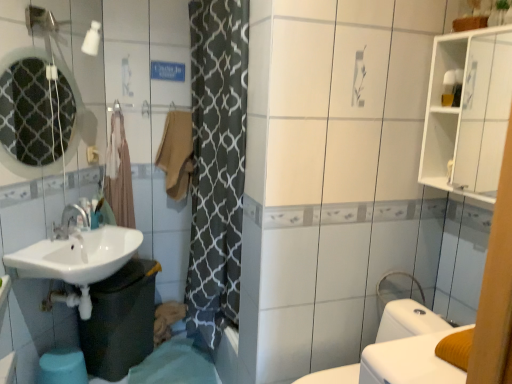
What do you see at coordinates (119, 174) in the screenshot?
I see `brown fabric shower curtain at left` at bounding box center [119, 174].

What do you see at coordinates (176, 153) in the screenshot?
I see `beige fabric towel at center` at bounding box center [176, 153].

The image size is (512, 384). What do you see at coordinates (77, 261) in the screenshot? I see `white glossy sink at lower left` at bounding box center [77, 261].

This screenshot has width=512, height=384. Identify the location of brown fabric shower curtain at left. (119, 174).

From a real-world perspective, is white glossy sink at lower left under brown fabric shower curtain at left?

Yes, from a real-world perspective, white glossy sink at lower left is beneath brown fabric shower curtain at left.

The width and height of the screenshot is (512, 384). Identify the location of sink below the brown fabric shower curtain at left (from a real-world perspective). (77, 261).

Does point (84, 259) appear closer or farther from the camera than point (116, 149)?

Point (84, 259) appears to be closer to the viewer than point (116, 149).

From the picture: Does white glossy sink at lower left have a greater width compared to brown fabric shower curtain at left?

Indeed, white glossy sink at lower left has a greater width compared to brown fabric shower curtain at left.

Can you tell me how much beige fabric towel at center and brown fabric shower curtain at left differ in facing direction?

0.000156 degrees.

Does beige fabric towel at center have a larger size compared to brown fabric shower curtain at left?

No.

Where is `shower curtain below the beige fabric towel at center (from a real-world perspective)`? The height and width of the screenshot is (384, 512). shower curtain below the beige fabric towel at center (from a real-world perspective) is located at coordinates (119, 174).

Does brown fabric shower curtain at left come behind white glossy medicine cabinet at upper right?

Yes, it is behind white glossy medicine cabinet at upper right.

Looking at this image, from the image's perspective, which object appears higher, brown fabric shower curtain at left or white glossy medicine cabinet at upper right?

white glossy medicine cabinet at upper right appears higher in the image.

Is brown fabric shower curtain at left completely or partially outside of white glossy medicine cabinet at upper right?

brown fabric shower curtain at left lies outside white glossy medicine cabinet at upper right's area.

Is brown fabric shower curtain at left shorter than white glossy medicine cabinet at upper right?

No.

From a real-world perspective, who is located higher, brown fabric shower curtain at left or white glossy sink at lower left?

brown fabric shower curtain at left is physically above.

Does brown fabric shower curtain at left lie in front of white glossy sink at lower left?

No, it is behind white glossy sink at lower left.

At what (x,y) coordinates should I click in order to perform the action: click on sink that appears below the brown fabric shower curtain at left (from the image's perspective). Please return your answer as a coordinate pair (x, y). The height and width of the screenshot is (384, 512). Looking at the image, I should click on (77, 261).

Does brown fabric shower curtain at left have a lesser height compared to white glossy sink at lower left?

No.

From a real-world perspective, who is located higher, matte glass mirror at upper left or white glossy medicine cabinet at upper right?

white glossy medicine cabinet at upper right.

Between matte glass mirror at upper left and white glossy medicine cabinet at upper right, which one has less height?

white glossy medicine cabinet at upper right is shorter.

Considering the relative positions of matte glass mirror at upper left and white glossy medicine cabinet at upper right in the image provided, is matte glass mirror at upper left to the right of white glossy medicine cabinet at upper right from the viewer's perspective?

In fact, matte glass mirror at upper left is to the left of white glossy medicine cabinet at upper right.

Between white glossy sink at lower left and beige fabric towel at center, which one has larger width?

With larger width is white glossy sink at lower left.

Is white glossy sink at lower left at the right side of beige fabric towel at center?

No.

Considering the positions of objects white glossy sink at lower left and beige fabric towel at center in the image provided, who is in front, white glossy sink at lower left or beige fabric towel at center?

white glossy sink at lower left is more forward.

Where is `medicine cabinet lying above the white glossy bidet at lower right (from the image's perspective)`? medicine cabinet lying above the white glossy bidet at lower right (from the image's perspective) is located at coordinates (468, 112).

What's the angular difference between white glossy medicine cabinet at upper right and white glossy bidet at lower right's facing directions?

2.43 degrees.

Looking at this image, from the image's perspective, is white glossy medicine cabinet at upper right positioned above or below white glossy bidet at lower right?

white glossy medicine cabinet at upper right is above white glossy bidet at lower right.

From a real-world perspective, who is located higher, white glossy medicine cabinet at upper right or white glossy bidet at lower right?

white glossy medicine cabinet at upper right, from a real-world perspective.

Where is `sink on the left side of brown fabric shower curtain at left`? sink on the left side of brown fabric shower curtain at left is located at coordinates (77, 261).

Locate an element on the screen. The image size is (512, 384). bath towel that appears above the brown fabric shower curtain at left (from the image's perspective) is located at coordinates (176, 153).

Looking at the image, which one is located closer to matte glass mirror at upper left, beige fabric towel at center or white glossy medicine cabinet at upper right?

beige fabric towel at center is closer to matte glass mirror at upper left.

From the image, which object appears to be nearer to beige fabric towel at center, matte glass mirror at upper left or white glossy sink at lower left?

Among the two, white glossy sink at lower left is located nearer to beige fabric towel at center.

Based on their spatial positions, is white glossy sink at lower left or white glossy bidet at lower right further from white glossy medicine cabinet at upper right?

Among the two, white glossy sink at lower left is located further to white glossy medicine cabinet at upper right.

Looking at the image, which one is located further to beige fabric towel at center, white glossy medicine cabinet at upper right or white glossy bidet at lower right?

white glossy medicine cabinet at upper right is positioned further to the anchor beige fabric towel at center.

Based on their spatial positions, is white glossy bidet at lower right or beige fabric towel at center closer to brown fabric shower curtain at left?

The object closer to brown fabric shower curtain at left is beige fabric towel at center.

Consider the image. Looking at the image, which one is located further to brown fabric shower curtain at left, beige fabric towel at center or matte glass mirror at upper left?

The object further to brown fabric shower curtain at left is matte glass mirror at upper left.

Estimate the real-world distances between objects in this image. Which object is closer to matte glass mirror at upper left, white glossy medicine cabinet at upper right or white glossy sink at lower left?

white glossy sink at lower left.

Estimate the real-world distances between objects in this image. Which object is further from brown fabric shower curtain at left, beige fabric towel at center or white glossy sink at lower left?

white glossy sink at lower left is positioned further to the anchor brown fabric shower curtain at left.

Where is `shower curtain between matte glass mirror at upper left and beige fabric towel at center along the z-axis`? shower curtain between matte glass mirror at upper left and beige fabric towel at center along the z-axis is located at coordinates (119, 174).

At what (x,y) coordinates should I click in order to perform the action: click on bath towel between matte glass mirror at upper left and white glossy sink at lower left in the up-down direction. Please return your answer as a coordinate pair (x, y). Looking at the image, I should click on (176, 153).

In order to click on bidet located between brown fabric shower curtain at left and white glossy medicine cabinet at upper right in the left-right direction in this screenshot , I will do `click(408, 321)`.

This screenshot has height=384, width=512. Find the location of `bidet between beige fabric towel at center and white glossy medicine cabinet at upper right`. bidet between beige fabric towel at center and white glossy medicine cabinet at upper right is located at coordinates (408, 321).